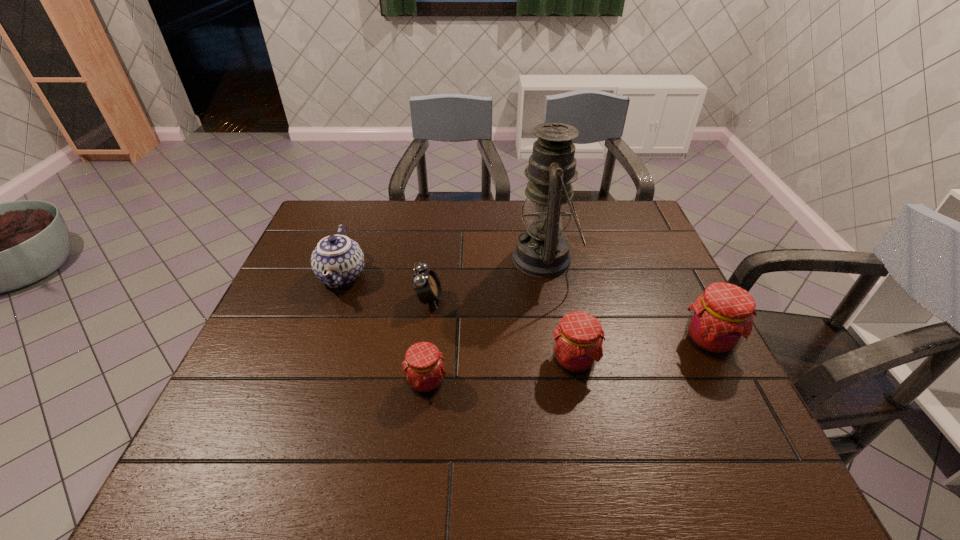
With all jams evenly spaced, where should an extra jam be placed on the left to continue the pattern? Please point out a vacant space. Please provide its 2D coordinates. Your answer should be formatted as a tuple, i.e. [(x, y)], where the tuple contains the x and y coordinates of a point satisfying the conditions above.

[(264, 406)]